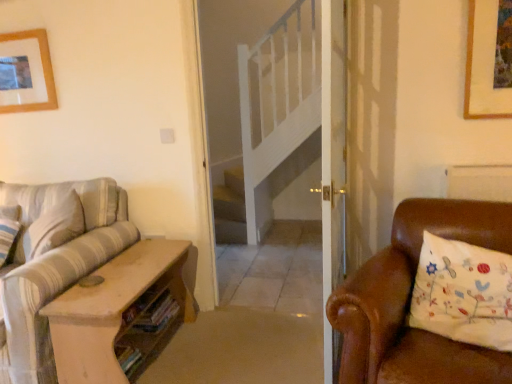
Question: Is striped fabric couch at left positioned with its back to wooden picture frame at upper left?

Choices:
 (A) yes
 (B) no

Answer: (B)

Question: From a real-world perspective, is striped fabric couch at left over wooden picture frame at upper left?

Choices:
 (A) no
 (B) yes

Answer: (A)

Question: Is striped fabric couch at left far from wooden picture frame at upper left?

Choices:
 (A) no
 (B) yes

Answer: (B)

Question: Does striped fabric couch at left come in front of wooden picture frame at upper left?

Choices:
 (A) no
 (B) yes

Answer: (B)

Question: From a real-world perspective, is striped fabric couch at left beneath wooden picture frame at upper left?

Choices:
 (A) no
 (B) yes

Answer: (B)

Question: Is white embroidered pillow at right wider or thinner than wooden picture frame at upper left?

Choices:
 (A) wide
 (B) thin

Answer: (A)

Question: Choose the correct answer: Is white embroidered pillow at right inside wooden picture frame at upper left or outside it?

Choices:
 (A) inside
 (B) outside

Answer: (B)

Question: Is point (458, 251) positioned closer to the camera than point (8, 66)?

Choices:
 (A) farther
 (B) closer

Answer: (B)

Question: Considering the positions of white embroidered pillow at right and wooden picture frame at upper left in the image, is white embroidered pillow at right taller or shorter than wooden picture frame at upper left?

Choices:
 (A) short
 (B) tall

Answer: (B)

Question: From the image's perspective, is striped fabric couch at left above or below wooden picture frame at upper left?

Choices:
 (A) above
 (B) below

Answer: (B)

Question: Is striped fabric couch at left to the left or to the right of wooden picture frame at upper left in the image?

Choices:
 (A) right
 (B) left

Answer: (A)

Question: From a real-world perspective, is striped fabric couch at left physically located above or below wooden picture frame at upper left?

Choices:
 (A) above
 (B) below

Answer: (B)

Question: Would you say striped fabric couch at left is inside or outside wooden picture frame at upper left?

Choices:
 (A) outside
 (B) inside

Answer: (A)

Question: From the image's perspective, relative to white embroidered pillow at right, is striped fabric couch at left above or below?

Choices:
 (A) below
 (B) above

Answer: (A)

Question: In the image, is striped fabric couch at left positioned in front of or behind white embroidered pillow at right?

Choices:
 (A) front
 (B) behind

Answer: (B)